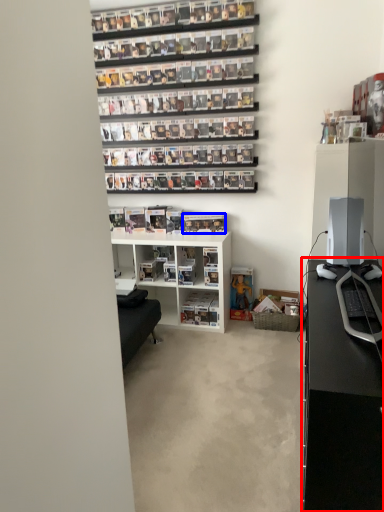
Question: Among these objects, which one is farthest to the camera, desk (highlighted by a red box) or book (highlighted by a blue box)?

Choices:
 (A) desk
 (B) book

Answer: (B)